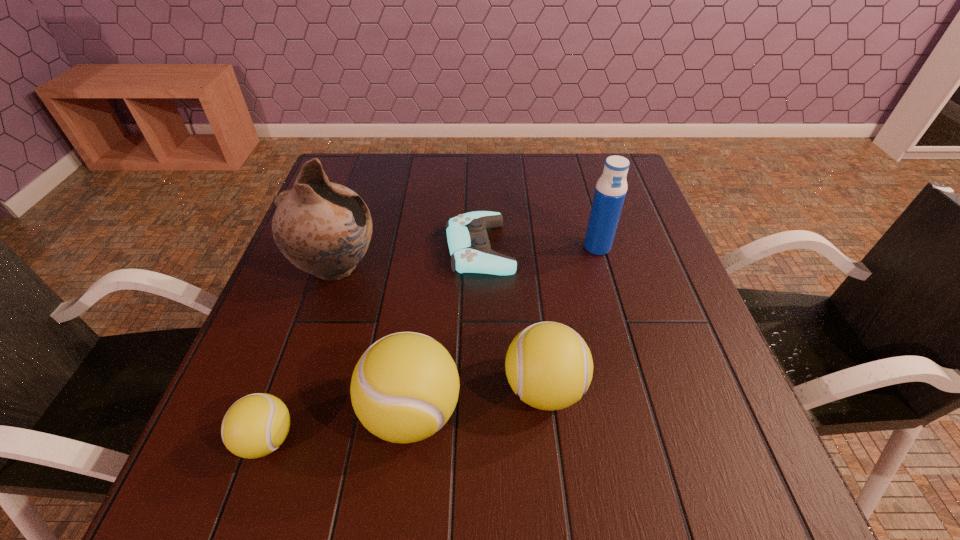
The width and height of the screenshot is (960, 540). What are the coordinates of `free spot that satisfies the following two spatial constraints: 1. from the spout of the second shortest tennis ball; 2. on the left side of the pottery` in the screenshot? It's located at (297, 389).

Where is `vacant space that satisfies the following two spatial constraints: 1. on the front side of the shortest object; 2. from the spout of the pottery`? vacant space that satisfies the following two spatial constraints: 1. on the front side of the shortest object; 2. from the spout of the pottery is located at coordinates (480, 268).